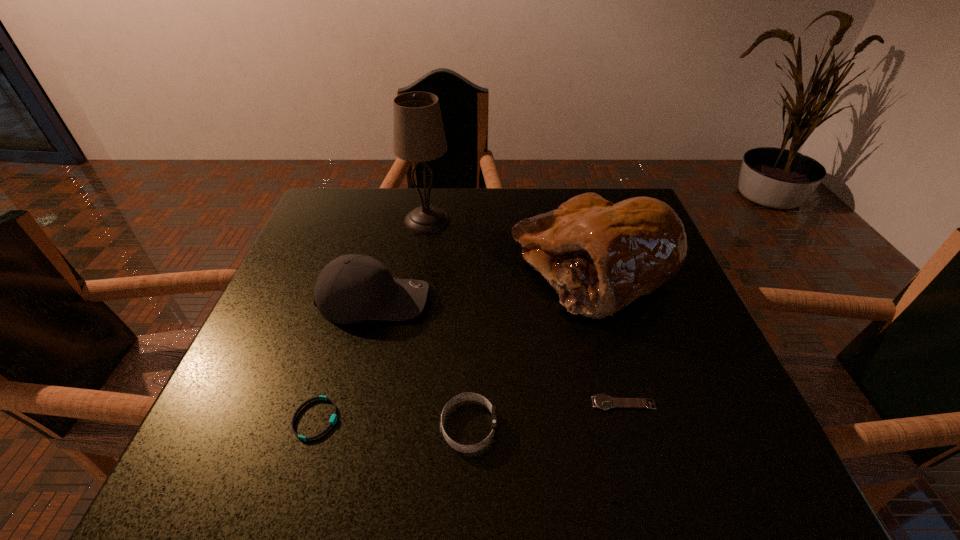
The height and width of the screenshot is (540, 960). What are the coordinates of `bread that is positioned at the right edge` in the screenshot? It's located at (600, 257).

Find the location of a particular element. The height and width of the screenshot is (540, 960). watch that is positioned at the right edge is located at coordinates (604, 402).

At what (x,y) coordinates should I click in order to perform the action: click on object positioned at the near left corner. Please return your answer as a coordinate pair (x, y). The width and height of the screenshot is (960, 540). Looking at the image, I should click on (333, 420).

Locate an element on the screen. object at the far right corner is located at coordinates (600, 257).

Find the location of `vacant space at the far edge of the desktop`. vacant space at the far edge of the desktop is located at coordinates (520, 202).

Identify the location of free space at the near edge of the desktop. This screenshot has width=960, height=540. (436, 483).

Find the location of `free space at the left edge of the desktop`. free space at the left edge of the desktop is located at coordinates (275, 359).

The width and height of the screenshot is (960, 540). I want to click on blank space at the right edge, so (x=678, y=349).

Where is `empty location between the tallest object and the watch`? empty location between the tallest object and the watch is located at coordinates (525, 312).

The width and height of the screenshot is (960, 540). Identify the location of free space between the third object from right to left and the lampshade. (448, 323).